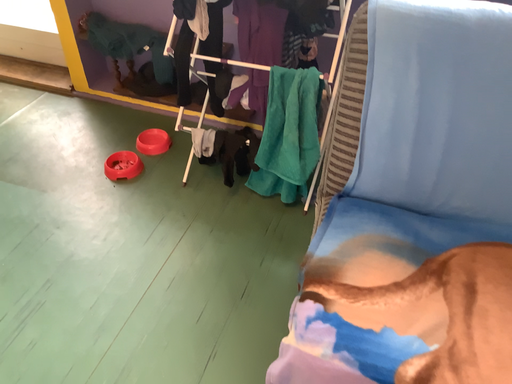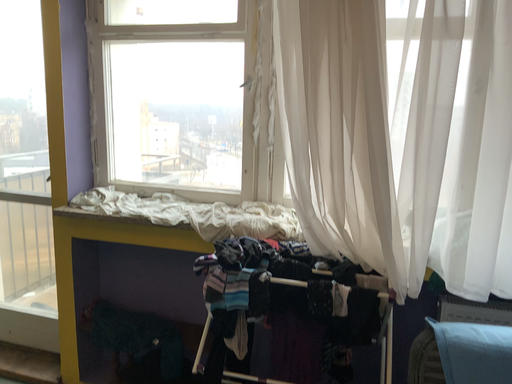
Question: How did the camera likely rotate when shooting the video?

Choices:
 (A) rotated downward
 (B) rotated upward

Answer: (B)